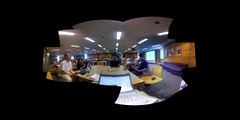
Identify the location of wooden wall. Image resolution: width=240 pixels, height=120 pixels. (185, 56), (93, 56), (45, 66).